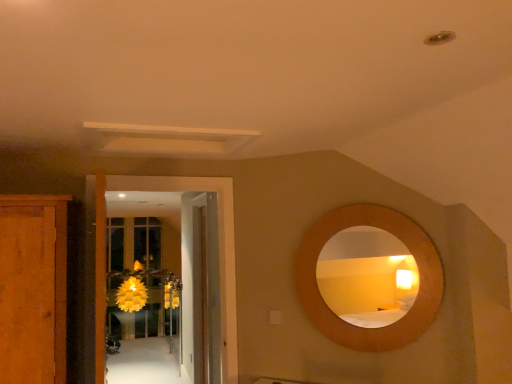
Question: Does white glossy door at center, the second door positioned from the back, have a larger size compared to wooden door at center, arranged as the 2th door when viewed from the front?

Choices:
 (A) yes
 (B) no

Answer: (B)

Question: Considering the relative positions of white glossy door at center, the second door positioned from the back, and wooden door at center, arranged as the 2th door when viewed from the front, in the image provided, is white glossy door at center, the second door positioned from the back, to the left of wooden door at center, arranged as the 2th door when viewed from the front, from the viewer's perspective?

Choices:
 (A) yes
 (B) no

Answer: (A)

Question: Is white glossy door at center, the second door positioned from the back, directly adjacent to wooden door at center, the first door positioned from the back?

Choices:
 (A) yes
 (B) no

Answer: (B)

Question: Is white glossy door at center, which ranks as the 1th door in front-to-back order, looking in the opposite direction of wooden door at center, arranged as the 2th door when viewed from the front?

Choices:
 (A) no
 (B) yes

Answer: (B)

Question: Is white glossy door at center, which ranks as the 1th door in front-to-back order, at the right side of wooden door at center, the first door positioned from the back?

Choices:
 (A) yes
 (B) no

Answer: (B)

Question: Considering the relative sizes of white glossy door at center, which ranks as the 1th door in front-to-back order, and wooden door at center, the first door positioned from the back, in the image provided, is white glossy door at center, which ranks as the 1th door in front-to-back order, wider than wooden door at center, the first door positioned from the back,?

Choices:
 (A) no
 (B) yes

Answer: (A)

Question: From a real-world perspective, is translucent yellow glass door at center on top of white glossy door at center, the second door positioned from the back?

Choices:
 (A) no
 (B) yes

Answer: (A)

Question: Does translucent yellow glass door at center have a larger size compared to white glossy door at center, which ranks as the 1th door in front-to-back order?

Choices:
 (A) yes
 (B) no

Answer: (A)

Question: Is translucent yellow glass door at center placed right next to white glossy door at center, the second door positioned from the back?

Choices:
 (A) no
 (B) yes

Answer: (A)

Question: Can you confirm if translucent yellow glass door at center is taller than white glossy door at center, the second door positioned from the back?

Choices:
 (A) no
 (B) yes

Answer: (A)

Question: From the image's perspective, would you say translucent yellow glass door at center is positioned over white glossy door at center, which ranks as the 1th door in front-to-back order?

Choices:
 (A) yes
 (B) no

Answer: (B)

Question: Is translucent yellow glass door at center not near white glossy door at center, which ranks as the 1th door in front-to-back order?

Choices:
 (A) yes
 (B) no

Answer: (A)

Question: Considering the relative positions of yellow paper flower at center and wooden door at center, arranged as the 2th door when viewed from the front, in the image provided, is yellow paper flower at center to the right of wooden door at center, arranged as the 2th door when viewed from the front, from the viewer's perspective?

Choices:
 (A) yes
 (B) no

Answer: (B)